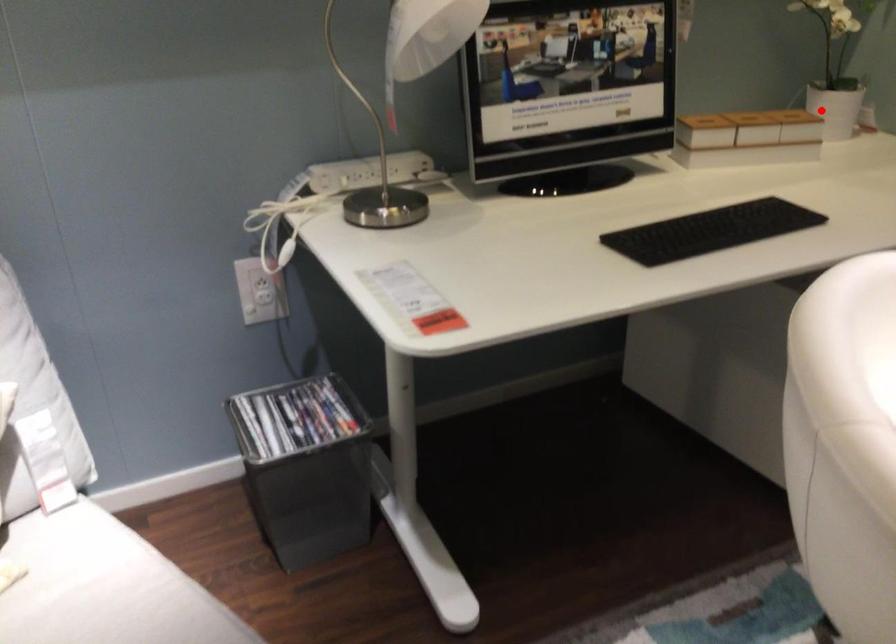
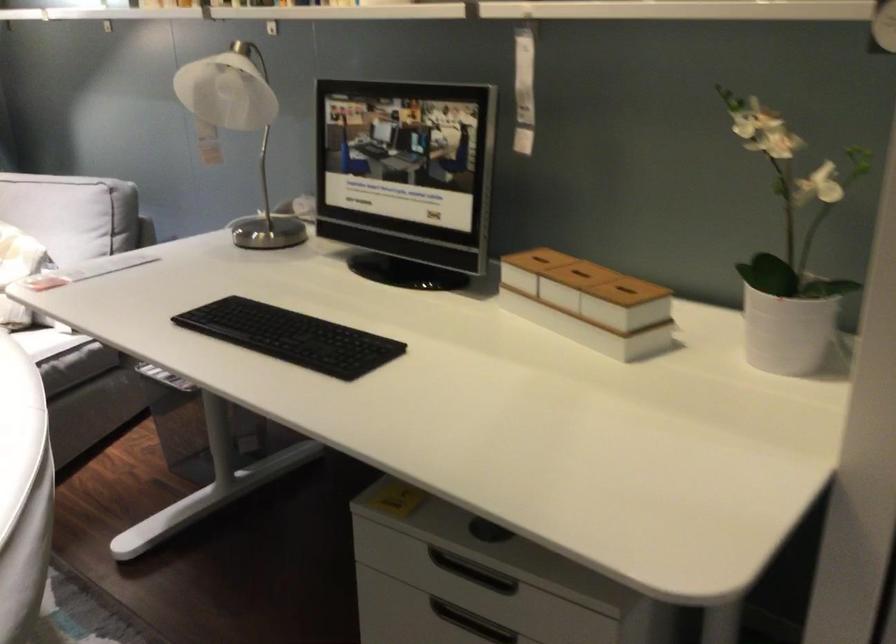
Where in the second image is the point corresponding to the highlighted location from the first image?

(627, 290)